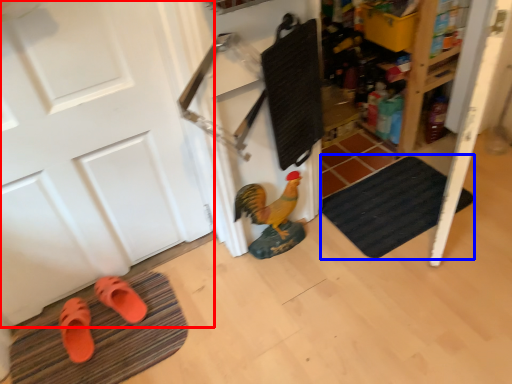
Question: Which point is closer to the camera, door (highlighted by a red box) or bath mat (highlighted by a blue box)?

Choices:
 (A) door
 (B) bath mat

Answer: (A)